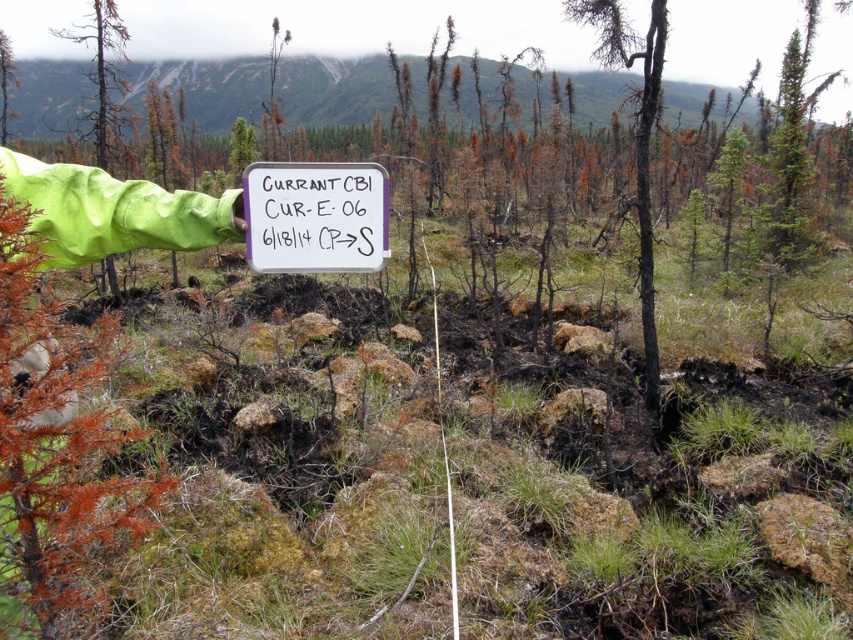
You are a researcher studying post wildfire recovery. You have a drone that can fly to a specific point in the image. You want to fly to the point at coordinates (635, 140). What will the drone be hovering over?

The point at coordinates (635, 140) is on a charred bark tree at center, so the drone will be hovering over the charred bark tree at center.